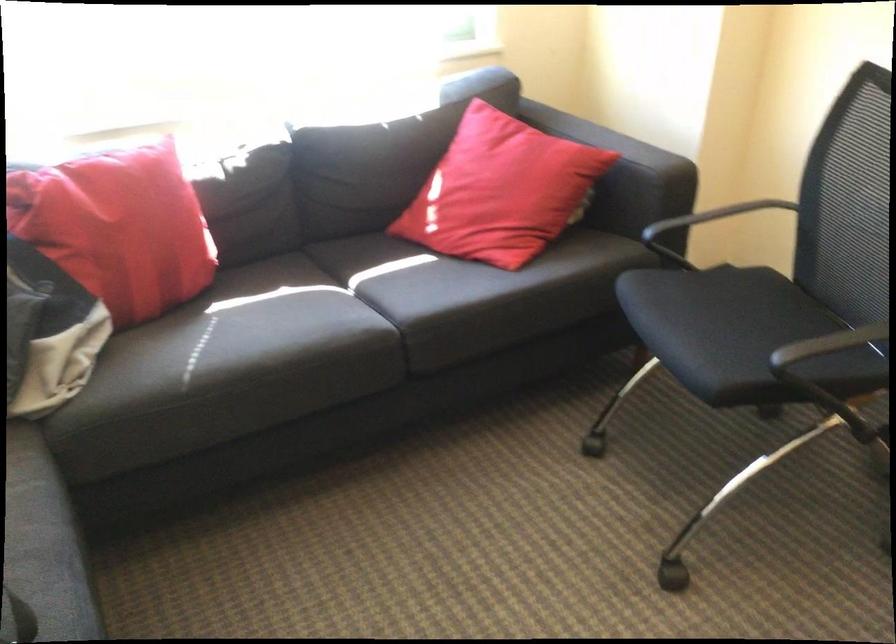
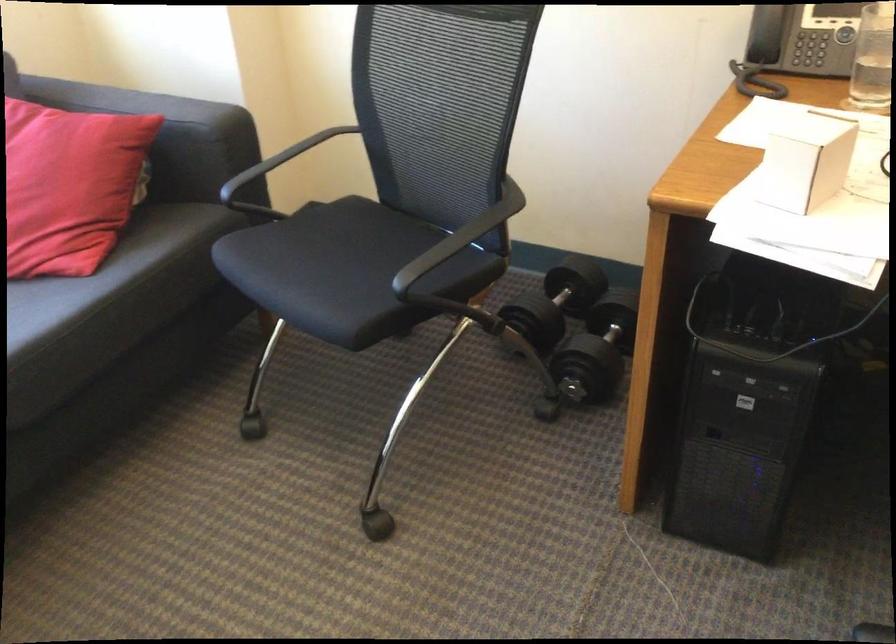
Find the pixel in the second image that matches [730,332] in the first image.

(343, 270)